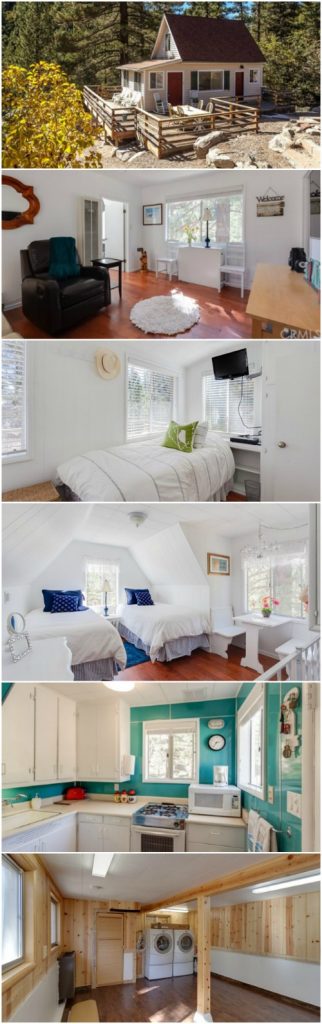
You are a GUI agent. You are given a task and a screenshot of the screen. Output one action in this format:
    pyautogui.click(x=<x>, y=<y>)
    Task: Click on the base cabinets
    The image size is (322, 1024).
    Given the screenshot: What is the action you would take?
    pyautogui.click(x=31, y=848), pyautogui.click(x=86, y=836), pyautogui.click(x=59, y=844), pyautogui.click(x=118, y=837), pyautogui.click(x=198, y=848)